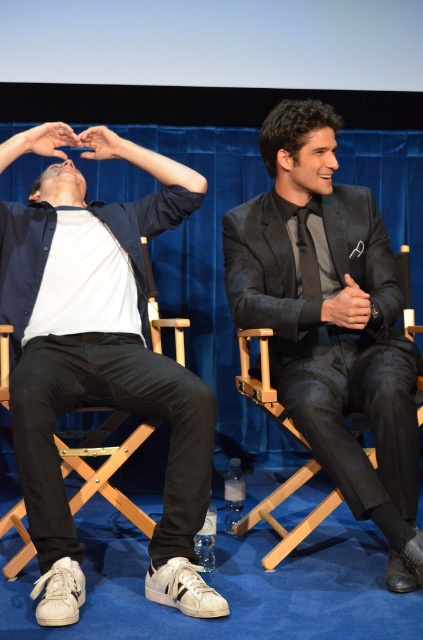
You are a photographer at the event. You need to place a small prop at the coordinates point (101, 371). According to the scene, what object is located at these coordinates?

The coordinates point (101, 371) correspond to the white leather sneakers at lower left.

You are designing a custom storage unit for the two objects in the scene. The white leather sneakers at lower left and the matte white hand at upper left need to be placed side by side. Based on their widths, which object should be placed on the left to ensure they fit without overlapping?

The white leather sneakers at lower left might be wider than the matte white hand at upper left, so placing the white leather sneakers at lower left on the left side would allow enough space between them to prevent overlapping.